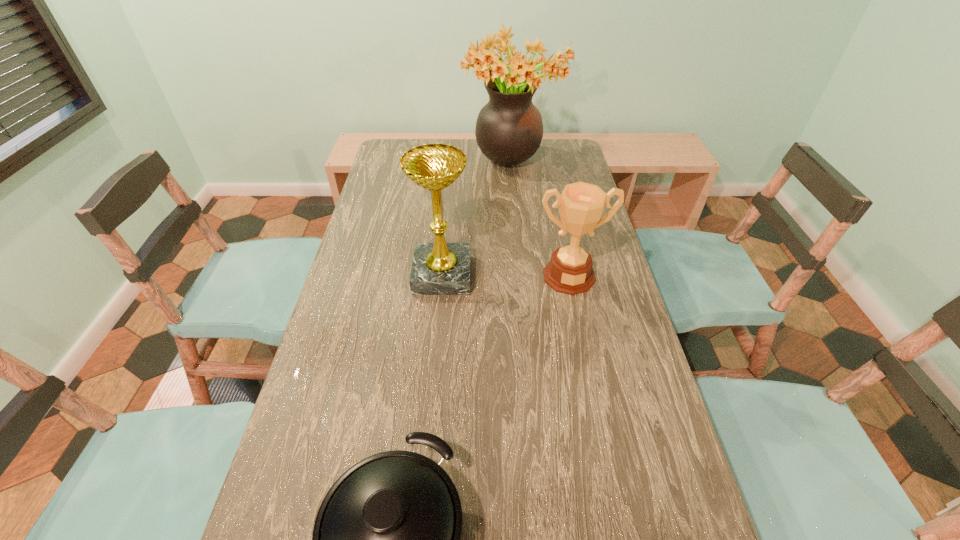
Locate which object is the closest to the farthest object. Please provide its 2D coordinates. Your answer should be formatted as a tuple, i.e. [(x, y)], where the tuple contains the x and y coordinates of a point satisfying the conditions above.

[(439, 268)]